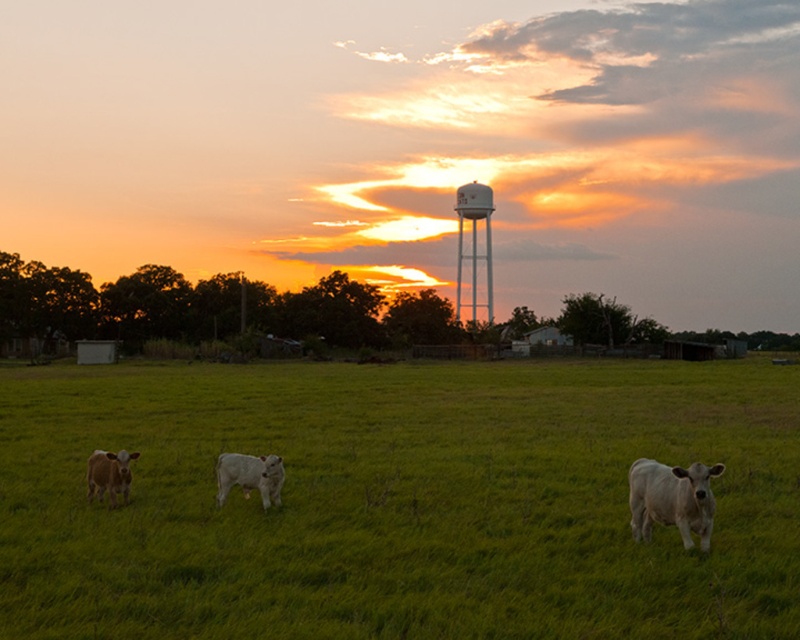
You are standing at the edge of the scene and want to walk towards the green grass pasture at center. According to the coordinates provided, in which direction should you head?

The green grass pasture at center is located at coordinates point (397, 500), which means you should head towards the right and slightly forward to reach it.

You are standing in the middle of the green grass pasture at center and want to walk towards the white smooth cow at lower right. Which direction should you move to get closer to the cow?

Since the green grass pasture at center is closer to the viewer than the white smooth cow at lower right, you should move forward in the direction towards the cow to get closer to it.